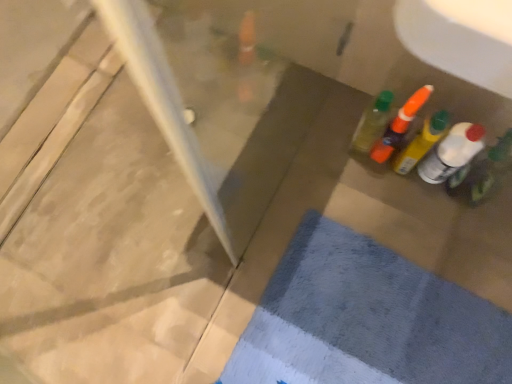
Describe the element at coordinates (372, 123) in the screenshot. The image size is (512, 384). I see `translucent plastic bottle at right, arranged as the 4th bottle when viewed from the right` at that location.

Image resolution: width=512 pixels, height=384 pixels. Identify the location of translucent plastic bottle at right, the third bottle in the left-to-right sequence. (422, 142).

Would you say translucent plastic bottle at right, positioned as the second bottle in right-to-left order, is outside translucent plastic bottle at right, which ranks as the first bottle in right-to-left order?

Indeed, translucent plastic bottle at right, positioned as the second bottle in right-to-left order, is completely outside translucent plastic bottle at right, which ranks as the first bottle in right-to-left order.

Which object is wider, translucent plastic bottle at right, positioned as the second bottle in right-to-left order, or translucent plastic bottle at right, which ranks as the first bottle in right-to-left order?

With larger width is translucent plastic bottle at right, positioned as the second bottle in right-to-left order.

Which is in front, point (429, 135) or point (434, 148)?

Point (429, 135)

Does translucent plastic bottle at right, which ranks as the first bottle in right-to-left order, have a greater width compared to translucent plastic bottle at right, acting as the first bottle starting from the left?

Incorrect, the width of translucent plastic bottle at right, which ranks as the first bottle in right-to-left order, does not surpass that of translucent plastic bottle at right, acting as the first bottle starting from the left.

Between translucent plastic bottle at right, which ranks as the first bottle in right-to-left order, and translucent plastic bottle at right, acting as the first bottle starting from the left, which one appears on the right side from the viewer's perspective?

Positioned to the right is translucent plastic bottle at right, which ranks as the first bottle in right-to-left order.

Does translucent plastic bottle at right, the fourth bottle positioned from the left, have a smaller size compared to translucent plastic bottle at right, arranged as the 4th bottle when viewed from the right?

Actually, translucent plastic bottle at right, the fourth bottle positioned from the left, might be larger than translucent plastic bottle at right, arranged as the 4th bottle when viewed from the right.

Is translucent plastic bottle at right, the fourth bottle positioned from the left, closer to camera compared to translucent plastic bottle at right, acting as the first bottle starting from the left?

Yes.

Can you confirm if translucent plastic bottle at right, acting as the first bottle starting from the left, is positioned to the left of blue textured bath mat at lower right?

Yes, translucent plastic bottle at right, acting as the first bottle starting from the left, is to the left of blue textured bath mat at lower right.

Considering the positions of objects translucent plastic bottle at right, arranged as the 4th bottle when viewed from the right, and blue textured bath mat at lower right in the image provided, who is in front, translucent plastic bottle at right, arranged as the 4th bottle when viewed from the right, or blue textured bath mat at lower right?

blue textured bath mat at lower right is in front.

Does translucent plastic bottle at right, acting as the first bottle starting from the left, have a greater width compared to blue textured bath mat at lower right?

No.

Does point (355, 139) appear closer or farther from the camera than point (434, 120)?

Clearly, point (355, 139) is more distant from the camera than point (434, 120).

Is translucent plastic bottle at right, arranged as the 4th bottle when viewed from the right, facing away from translucent plastic bottle at right, the third bottle in the left-to-right sequence?

No, translucent plastic bottle at right, arranged as the 4th bottle when viewed from the right, is not facing away from translucent plastic bottle at right, the third bottle in the left-to-right sequence.

Which is correct: translucent plastic bottle at right, acting as the first bottle starting from the left, is inside translucent plastic bottle at right, positioned as the second bottle in right-to-left order, or outside of it?

translucent plastic bottle at right, acting as the first bottle starting from the left, is not inside translucent plastic bottle at right, positioned as the second bottle in right-to-left order, it's outside.

Can you confirm if translucent plastic bottle at right, the third bottle in the left-to-right sequence, is shorter than translucent orange bottle at upper right, the second bottle when ordered from left to right?

Indeed, translucent plastic bottle at right, the third bottle in the left-to-right sequence, has a lesser height compared to translucent orange bottle at upper right, the second bottle when ordered from left to right.

Is translucent plastic bottle at right, positioned as the second bottle in right-to-left order, with translucent orange bottle at upper right, the second bottle when ordered from left to right?

Yes, translucent plastic bottle at right, positioned as the second bottle in right-to-left order, is touching translucent orange bottle at upper right, the second bottle when ordered from left to right.

Between translucent plastic bottle at right, the third bottle in the left-to-right sequence, and translucent orange bottle at upper right, the 3th bottle when ordered from right to left, which one is positioned in front?

translucent plastic bottle at right, the third bottle in the left-to-right sequence, is closer to the camera.

How different are the orientations of translucent plastic bottle at right, the third bottle in the left-to-right sequence, and translucent orange bottle at upper right, the second bottle when ordered from left to right, in degrees?

The angular difference between translucent plastic bottle at right, the third bottle in the left-to-right sequence, and translucent orange bottle at upper right, the second bottle when ordered from left to right, is 4.35 degrees.

Is blue textured bath mat at lower right far from translucent plastic bottle at right, the fourth bottle positioned from the left?

That's not correct — blue textured bath mat at lower right is a little close to translucent plastic bottle at right, the fourth bottle positioned from the left.

Can you confirm if blue textured bath mat at lower right is positioned to the right of translucent plastic bottle at right, the fourth bottle positioned from the left?

In fact, blue textured bath mat at lower right is to the left of translucent plastic bottle at right, the fourth bottle positioned from the left.

From the image's perspective, which one is positioned higher, blue textured bath mat at lower right or translucent plastic bottle at right, the fourth bottle positioned from the left?

translucent plastic bottle at right, the fourth bottle positioned from the left, appears higher in the image.

Does blue textured bath mat at lower right have a larger size compared to translucent plastic bottle at right, the fourth bottle positioned from the left?

Yes, blue textured bath mat at lower right is bigger than translucent plastic bottle at right, the fourth bottle positioned from the left.

Consider the image. Relative to blue textured bath mat at lower right, is translucent plastic bottle at right, which ranks as the first bottle in right-to-left order, in front or behind?

translucent plastic bottle at right, which ranks as the first bottle in right-to-left order, is positioned closer to the viewer than blue textured bath mat at lower right.

Is blue textured bath mat at lower right at the back of translucent plastic bottle at right, the fourth bottle positioned from the left?

That's not correct — translucent plastic bottle at right, the fourth bottle positioned from the left, is not looking away from blue textured bath mat at lower right.

Is translucent plastic bottle at right, which ranks as the first bottle in right-to-left order, far from blue textured bath mat at lower right?

That's not correct — translucent plastic bottle at right, which ranks as the first bottle in right-to-left order, is a little close to blue textured bath mat at lower right.

Who is smaller, translucent plastic bottle at right, the fourth bottle positioned from the left, or blue textured bath mat at lower right?

With smaller size is translucent plastic bottle at right, the fourth bottle positioned from the left.

I want to click on the 2nd bottle located beneath the translucent plastic bottle at right, positioned as the second bottle in right-to-left order (from a real-world perspective), so [x=452, y=152].

From the image's perspective, which bottle is the 3rd one above the translucent plastic bottle at right, which ranks as the first bottle in right-to-left order? Please provide its 2D coordinates.

[(372, 123)]

Based on their spatial positions, is translucent plastic bottle at right, positioned as the second bottle in right-to-left order, or translucent plastic bottle at right, which ranks as the first bottle in right-to-left order, further from translucent orange bottle at upper right, the second bottle when ordered from left to right?

translucent plastic bottle at right, which ranks as the first bottle in right-to-left order, is further to translucent orange bottle at upper right, the second bottle when ordered from left to right.

When comparing their distances from translucent plastic bottle at right, acting as the first bottle starting from the left, does translucent plastic bottle at right, the fourth bottle positioned from the left, or translucent orange bottle at upper right, the second bottle when ordered from left to right, seem further?

Among the two, translucent plastic bottle at right, the fourth bottle positioned from the left, is located further to translucent plastic bottle at right, acting as the first bottle starting from the left.

Looking at the image, which one is located closer to blue textured bath mat at lower right, translucent orange bottle at upper right, the 3th bottle when ordered from right to left, or translucent plastic bottle at right, positioned as the second bottle in right-to-left order?

translucent plastic bottle at right, positioned as the second bottle in right-to-left order, is positioned closer to the anchor blue textured bath mat at lower right.

Estimate the real-world distances between objects in this image. Which object is further from translucent plastic bottle at right, arranged as the 4th bottle when viewed from the right, blue textured bath mat at lower right or translucent plastic bottle at right, which ranks as the first bottle in right-to-left order?

blue textured bath mat at lower right is further to translucent plastic bottle at right, arranged as the 4th bottle when viewed from the right.

Based on their spatial positions, is translucent plastic bottle at right, positioned as the second bottle in right-to-left order, or blue textured bath mat at lower right further from translucent plastic bottle at right, arranged as the 4th bottle when viewed from the right?

The object further to translucent plastic bottle at right, arranged as the 4th bottle when viewed from the right, is blue textured bath mat at lower right.

Based on their spatial positions, is translucent orange bottle at upper right, the second bottle when ordered from left to right, or translucent plastic bottle at right, acting as the first bottle starting from the left, further from translucent plastic bottle at right, the third bottle in the left-to-right sequence?

translucent plastic bottle at right, acting as the first bottle starting from the left, lies further to translucent plastic bottle at right, the third bottle in the left-to-right sequence, than the other object.

In the scene shown: Which object lies nearer to the anchor point translucent plastic bottle at right, the fourth bottle positioned from the left, blue textured bath mat at lower right or translucent orange bottle at upper right, the 3th bottle when ordered from right to left?

translucent orange bottle at upper right, the 3th bottle when ordered from right to left, is positioned closer to the anchor translucent plastic bottle at right, the fourth bottle positioned from the left.

From the image, which object appears to be nearer to translucent plastic bottle at right, which ranks as the first bottle in right-to-left order, translucent orange bottle at upper right, the second bottle when ordered from left to right, or blue textured bath mat at lower right?

translucent orange bottle at upper right, the second bottle when ordered from left to right, lies closer to translucent plastic bottle at right, which ranks as the first bottle in right-to-left order, than the other object.

This screenshot has height=384, width=512. Identify the location of bottle that lies between translucent plastic bottle at right, positioned as the second bottle in right-to-left order, and blue textured bath mat at lower right from top to bottom. tap(452, 152).

Identify the location of bottle between translucent orange bottle at upper right, the second bottle when ordered from left to right, and translucent plastic bottle at right, the fourth bottle positioned from the left, from left to right. This screenshot has height=384, width=512. [x=422, y=142].

The image size is (512, 384). In order to click on bottle between translucent plastic bottle at right, arranged as the 4th bottle when viewed from the right, and translucent plastic bottle at right, the third bottle in the left-to-right sequence, in the horizontal direction in this screenshot , I will do `click(400, 125)`.